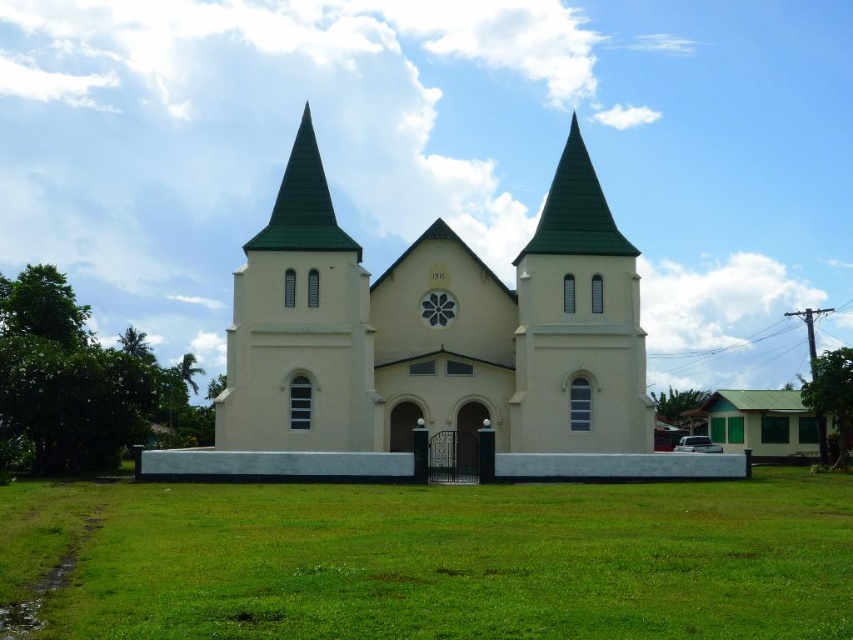
You are standing in front of the church and notice two points marked on the ground. One is at point (370,596) and the other is at point (335,227). Which point is closer to you?

Point (370,596) is closer to the viewer than point (335,227).

You are standing in a park and see the green grass at center and the beige concrete church at center. Which one is taller?

The beige concrete church at center is taller than the green grass at center.

You are standing at the entrance of the church and want to walk to the green grass at center. According to the 2D coordinates provided, in which direction should you move from your current position?

The green grass at center is located at coordinates point (439, 560). Since you are at the entrance, you should move forward towards the green grass at center as it is positioned ahead of you in the central area.